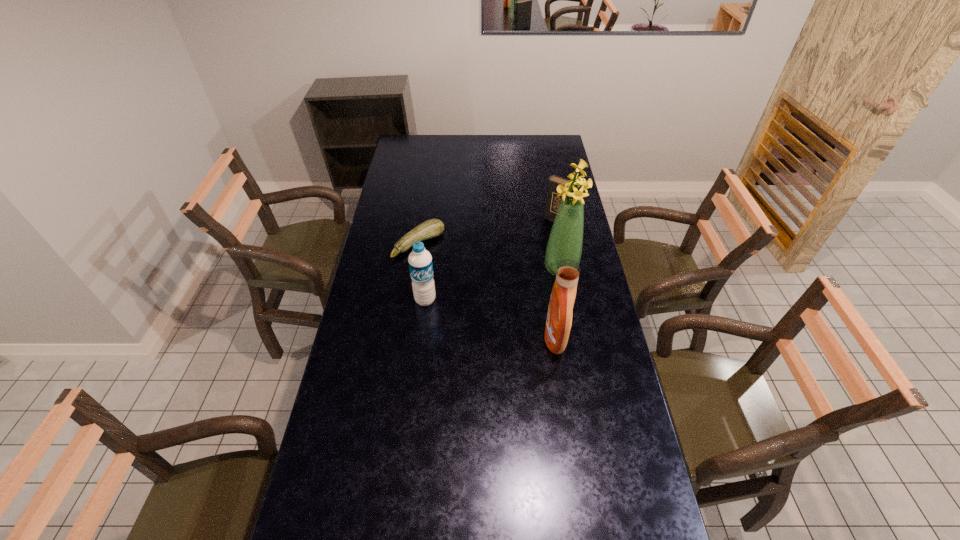
At what (x,y) coordinates should I click in order to perform the action: click on free region located 0.290m on the front-facing side of the fourth shortest object. Please return your answer as a coordinate pair (x, y). This screenshot has height=540, width=960. Looking at the image, I should click on (461, 338).

Identify the location of free space located 0.110m at the stem end of the shortest object. Image resolution: width=960 pixels, height=540 pixels. coord(449,272).

I want to click on vacant area situated at the stem end of the shortest object, so click(x=469, y=291).

Locate an element on the screen. The height and width of the screenshot is (540, 960). vacant space located at the stem end of the shortest object is located at coordinates (451, 274).

Where is `vacant position located 0.330m on the front-facing side of the tallest object`? The image size is (960, 540). vacant position located 0.330m on the front-facing side of the tallest object is located at coordinates (485, 319).

Where is `free space located 0.200m on the front-facing side of the tallest object`? The width and height of the screenshot is (960, 540). free space located 0.200m on the front-facing side of the tallest object is located at coordinates (512, 301).

Find the location of `free space located on the front-facing side of the tallest object`. free space located on the front-facing side of the tallest object is located at coordinates (514, 300).

Locate an element on the screen. free space located on the front cover of the diary is located at coordinates (530, 254).

What are the coordinates of `vacant space located on the front cover of the diary` in the screenshot? It's located at (513, 272).

The width and height of the screenshot is (960, 540). Find the location of `free spot located on the front cover of the diary`. free spot located on the front cover of the diary is located at coordinates (532, 251).